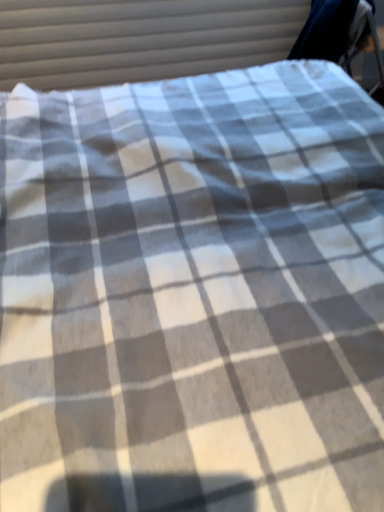
Question: From the image's perspective, does dark blue fabric swivel chair at upper right appear lower than white checkered fabric at upper center?

Choices:
 (A) yes
 (B) no

Answer: (B)

Question: Is dark blue fabric swivel chair at upper right positioned before white checkered fabric at upper center?

Choices:
 (A) no
 (B) yes

Answer: (B)

Question: From the image's perspective, is dark blue fabric swivel chair at upper right on white checkered fabric at upper center?

Choices:
 (A) yes
 (B) no

Answer: (A)

Question: Does dark blue fabric swivel chair at upper right have a greater height compared to white checkered fabric at upper center?

Choices:
 (A) no
 (B) yes

Answer: (A)

Question: Is dark blue fabric swivel chair at upper right beside white checkered fabric at upper center?

Choices:
 (A) no
 (B) yes

Answer: (A)

Question: Does dark blue fabric swivel chair at upper right have a larger size compared to white checkered fabric at upper center?

Choices:
 (A) no
 (B) yes

Answer: (B)

Question: Could you tell me if white checkered fabric at upper center is turned towards dark blue fabric swivel chair at upper right?

Choices:
 (A) no
 (B) yes

Answer: (B)

Question: Is white checkered fabric at upper center looking in the opposite direction of dark blue fabric swivel chair at upper right?

Choices:
 (A) yes
 (B) no

Answer: (B)

Question: Can you confirm if white checkered fabric at upper center is thinner than dark blue fabric swivel chair at upper right?

Choices:
 (A) no
 (B) yes

Answer: (B)

Question: Is white checkered fabric at upper center to the right of dark blue fabric swivel chair at upper right from the viewer's perspective?

Choices:
 (A) no
 (B) yes

Answer: (A)

Question: Does white checkered fabric at upper center have a larger size compared to dark blue fabric swivel chair at upper right?

Choices:
 (A) yes
 (B) no

Answer: (B)

Question: Is white checkered fabric at upper center at the left side of dark blue fabric swivel chair at upper right?

Choices:
 (A) yes
 (B) no

Answer: (A)

Question: Is point (357, 27) positioned closer to the camera than point (84, 10)?

Choices:
 (A) closer
 (B) farther

Answer: (B)